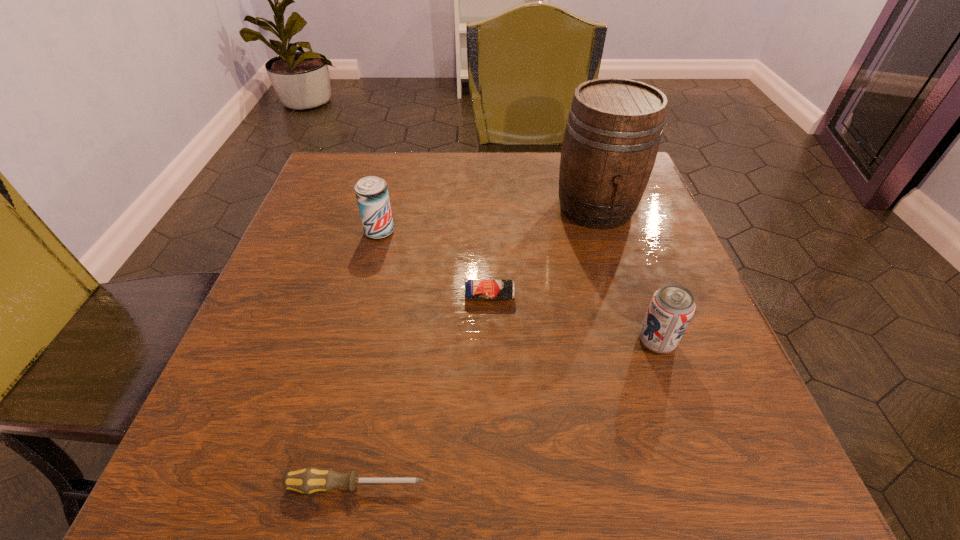
Where is `vacant space situated on the front of the second beer can from left to right`? The height and width of the screenshot is (540, 960). vacant space situated on the front of the second beer can from left to right is located at coordinates (491, 349).

Find the location of a particular element. The width and height of the screenshot is (960, 540). free space located 0.180m at the tip of the nearest object is located at coordinates click(564, 485).

Where is `object present at the far edge`? The width and height of the screenshot is (960, 540). object present at the far edge is located at coordinates (613, 131).

You are a GUI agent. You are given a task and a screenshot of the screen. Output one action in this format:
    pyautogui.click(x=<x>, y=<y>)
    Task: Click on the object present at the near edge
    The height and width of the screenshot is (540, 960).
    Given the screenshot: What is the action you would take?
    coord(308,480)

Locate an element on the screen. This screenshot has height=540, width=960. beer can at the left edge is located at coordinates (371, 192).

This screenshot has height=540, width=960. I want to click on screwdriver at the left edge, so click(308, 480).

Find the location of `cider situated at the right edge`. cider situated at the right edge is located at coordinates (613, 131).

This screenshot has width=960, height=540. I want to click on beer can at the right edge, so click(x=671, y=308).

Locate an element on the screen. object positioned at the near left corner is located at coordinates (308, 480).

The image size is (960, 540). In order to click on object positioned at the far right corner in this screenshot , I will do `click(613, 131)`.